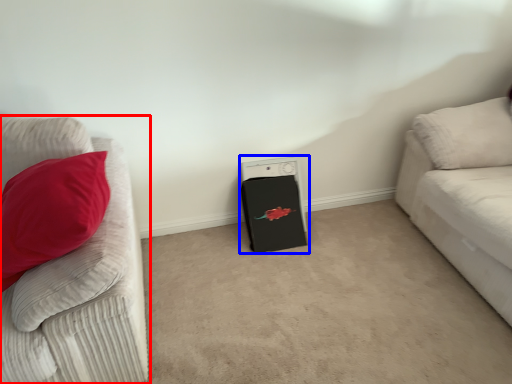
Question: Which of the following is the closest to the observer, studio couch (highlighted by a red box) or appliance (highlighted by a blue box)?

Choices:
 (A) studio couch
 (B) appliance

Answer: (A)